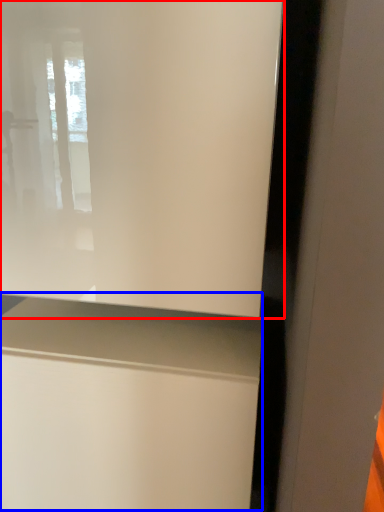
Question: Which of the following is the closest to the observer, window (highlighted by a red box) or vanity (highlighted by a blue box)?

Choices:
 (A) window
 (B) vanity

Answer: (A)